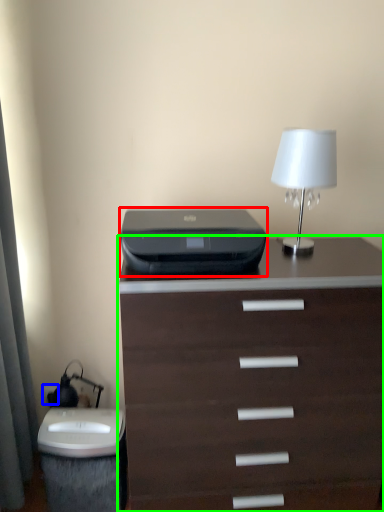
Question: Estimate the real-world distances between objects in this image. Which object is closer to printer (highlighted by a red box), electric outlet (highlighted by a blue box) or chest of drawers (highlighted by a green box)?

Choices:
 (A) electric outlet
 (B) chest of drawers

Answer: (B)